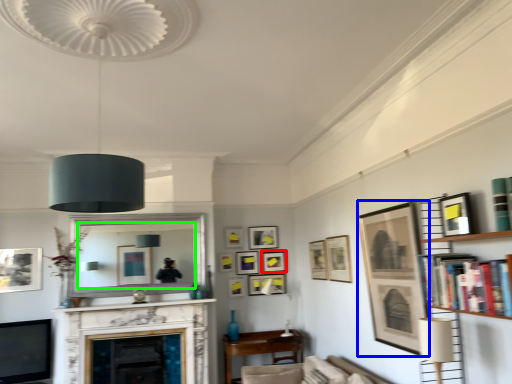
Question: Considering the real-world distances, which object is farthest from picture frame (highlighted by a red box)? picture frame (highlighted by a blue box) or mirror (highlighted by a green box)?

Choices:
 (A) picture frame
 (B) mirror

Answer: (A)